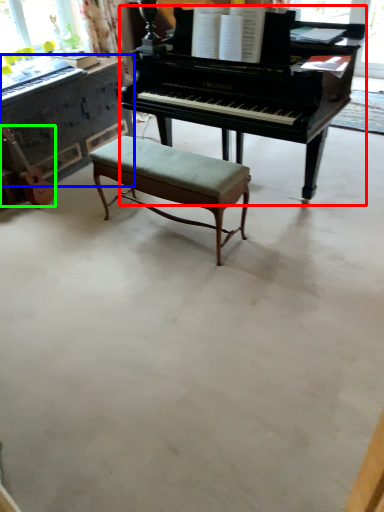
Question: Which is farther away from piano (highlighted by a red box)? piano (highlighted by a blue box) or guitar (highlighted by a green box)?

Choices:
 (A) piano
 (B) guitar

Answer: (B)